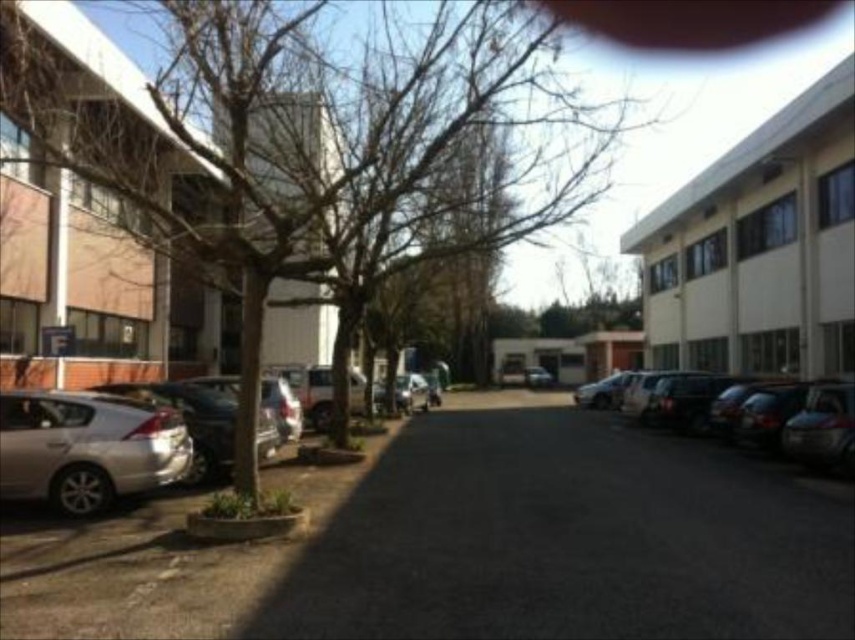
Based on the photo, who is positioned more to the right, black asphalt parking lot at center or satin silver car at lower left?

black asphalt parking lot at center is more to the right.

Does black asphalt parking lot at center lie behind satin silver car at lower left?

No, black asphalt parking lot at center is closer to the viewer.

Between point (49, 531) and point (154, 476), which one is positioned behind?

Positioned behind is point (154, 476).

Locate an element on the screen. The image size is (855, 640). black asphalt parking lot at center is located at coordinates pos(469,544).

Can you confirm if black asphalt parking lot at center is positioned to the right of metallic silver car at right?

No, black asphalt parking lot at center is not to the right of metallic silver car at right.

Where is `black asphalt parking lot at center`? Image resolution: width=855 pixels, height=640 pixels. black asphalt parking lot at center is located at coordinates 469,544.

What do you see at coordinates (469, 544) in the screenshot?
I see `black asphalt parking lot at center` at bounding box center [469, 544].

The width and height of the screenshot is (855, 640). I want to click on black asphalt parking lot at center, so click(x=469, y=544).

Does black asphalt parking lot at center have a larger size compared to metallic silver car at center?

Correct, black asphalt parking lot at center is larger in size than metallic silver car at center.

Which is below, black asphalt parking lot at center or metallic silver car at center?

metallic silver car at center

Locate an element on the screen. black asphalt parking lot at center is located at coordinates (469, 544).

Image resolution: width=855 pixels, height=640 pixels. What are the coordinates of `black asphalt parking lot at center` in the screenshot? It's located at (469, 544).